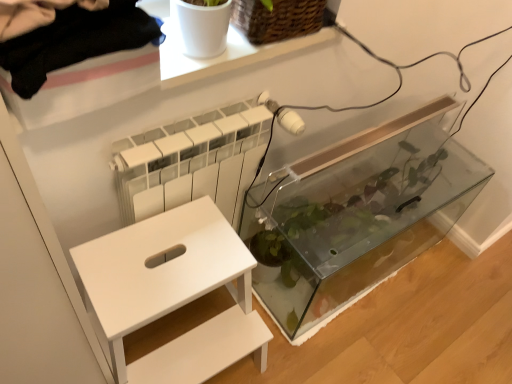
What is the approximate height of white matte step stool at lower left?

The height of white matte step stool at lower left is 20.11 inches.

Where is `woven brown basket at upper center`? woven brown basket at upper center is located at coordinates (277, 19).

Between woven brown basket at upper center and white matte step stool at lower left, which one has larger size?

Bigger between the two is white matte step stool at lower left.

In the scene shown: From a real-world perspective, relative to white matte step stool at lower left, is woven brown basket at upper center vertically above or below?

Clearly, from a real-world perspective, woven brown basket at upper center is above white matte step stool at lower left.

Is woven brown basket at upper center aimed at white matte step stool at lower left?

No, woven brown basket at upper center is not facing towards white matte step stool at lower left.

Is white matte step stool at lower left positioned beyond the bounds of transparent glass tank at center?

Indeed, white matte step stool at lower left is completely outside transparent glass tank at center.

From the picture: From a real-world perspective, does white matte step stool at lower left sit lower than transparent glass tank at center?

No, from a real-world perspective, white matte step stool at lower left is not below transparent glass tank at center.

Considering the relative sizes of white matte step stool at lower left and transparent glass tank at center in the image provided, is white matte step stool at lower left bigger than transparent glass tank at center?

No.

Is white matte step stool at lower left turned away from transparent glass tank at center?

No, white matte step stool at lower left's orientation is not away from transparent glass tank at center.

Which is closer, (x=405, y=212) or (x=148, y=300)?

Clearly, point (x=405, y=212) is more distant from the camera than point (x=148, y=300).

Based on the photo, from a real-world perspective, is transparent glass tank at center positioned above or below white matte step stool at lower left?

transparent glass tank at center is below white matte step stool at lower left.

From the image's perspective, would you say transparent glass tank at center is shown under white matte step stool at lower left?

No, from the image's perspective, transparent glass tank at center is not below white matte step stool at lower left.

Considering the sizes of objects transparent glass tank at center and white matte step stool at lower left in the image provided, who is smaller, transparent glass tank at center or white matte step stool at lower left?

white matte step stool at lower left.

I want to click on basket that appears above the white matte step stool at lower left (from the image's perspective), so click(277, 19).

From a real-world perspective, between white matte step stool at lower left and woven brown basket at upper center, who is vertically lower?

white matte step stool at lower left.

Are white matte step stool at lower left and woven brown basket at upper center located far from each other?

white matte step stool at lower left is near woven brown basket at upper center, not far away.

Can you confirm if white matte step stool at lower left is positioned to the right of woven brown basket at upper center?

In fact, white matte step stool at lower left is to the left of woven brown basket at upper center.

Is woven brown basket at upper center behind transparent glass tank at center?

No, it is not.

Considering the relative sizes of woven brown basket at upper center and transparent glass tank at center in the image provided, is woven brown basket at upper center bigger than transparent glass tank at center?

Incorrect, woven brown basket at upper center is not larger than transparent glass tank at center.

Is woven brown basket at upper center positioned with its back to transparent glass tank at center?

No, transparent glass tank at center is not at the back of woven brown basket at upper center.

Which point is more forward, (315, 23) or (338, 291)?

The point (315, 23) is more forward.

Which is in front, point (254, 276) or point (246, 1)?

The point (246, 1) is closer.

Is transparent glass tank at center facing away from woven brown basket at upper center?

That's not correct — transparent glass tank at center is not looking away from woven brown basket at upper center.

Is the depth of transparent glass tank at center less than that of woven brown basket at upper center?

No.

Is transparent glass tank at center wider or thinner than woven brown basket at upper center?

Considering their sizes, transparent glass tank at center looks broader than woven brown basket at upper center.

Find the location of a particular element. furniture that is under the woven brown basket at upper center (from a real-world perspective) is located at coordinates (172, 293).

Locate an element on the screen. This screenshot has width=512, height=384. glass box above the white matte step stool at lower left (from the image's perspective) is located at coordinates pos(362,212).

Considering their positions, is woven brown basket at upper center positioned further to white matte step stool at lower left than transparent glass tank at center?

Based on the image, woven brown basket at upper center appears to be further to white matte step stool at lower left.

Based on their spatial positions, is woven brown basket at upper center or white matte step stool at lower left further from transparent glass tank at center?

woven brown basket at upper center lies further to transparent glass tank at center than the other object.

Looking at this image, considering their positions, is white matte step stool at lower left positioned further to transparent glass tank at center than woven brown basket at upper center?

woven brown basket at upper center is further to transparent glass tank at center.

Looking at the image, which one is located further to woven brown basket at upper center, white matte step stool at lower left or transparent glass tank at center?

Among the two, transparent glass tank at center is located further to woven brown basket at upper center.

Considering their positions, is transparent glass tank at center positioned further to white matte step stool at lower left than woven brown basket at upper center?

Among the two, woven brown basket at upper center is located further to white matte step stool at lower left.

Looking at the image, which one is located further to woven brown basket at upper center, transparent glass tank at center or white matte step stool at lower left?

Among the two, transparent glass tank at center is located further to woven brown basket at upper center.

At what (x,y) coordinates should I click in order to perform the action: click on glass box between woven brown basket at upper center and white matte step stool at lower left from top to bottom. Please return your answer as a coordinate pair (x, y). Image resolution: width=512 pixels, height=384 pixels. Looking at the image, I should click on (362, 212).